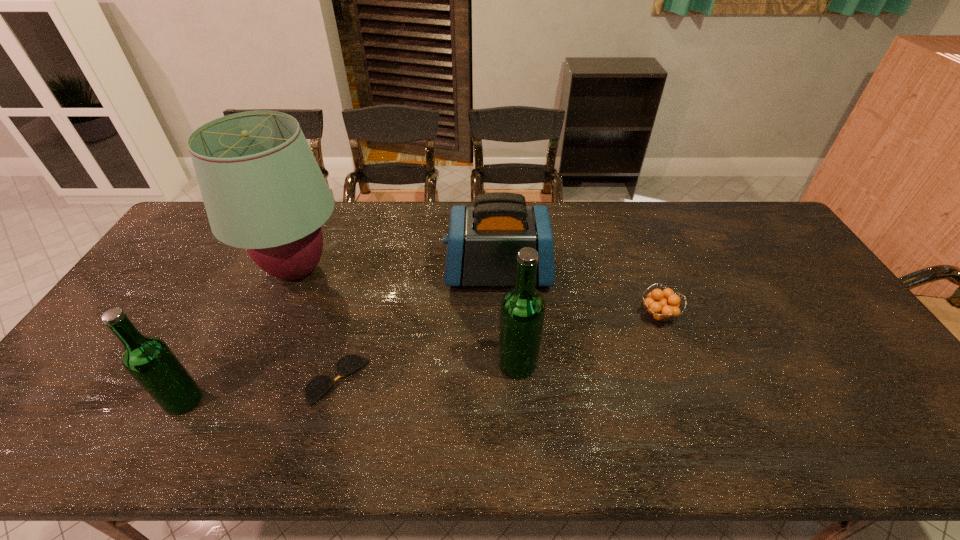
Locate an element on the screen. The height and width of the screenshot is (540, 960). vacant space located on the right of the right beer bottle is located at coordinates (568, 363).

At what (x,y) coordinates should I click in order to perform the action: click on free space located 0.200m on the left of the tallest object. Please return your answer as a coordinate pair (x, y). The image size is (960, 540). Looking at the image, I should click on (181, 270).

Where is `vacant space located on the front of the orange fruit`? The width and height of the screenshot is (960, 540). vacant space located on the front of the orange fruit is located at coordinates (676, 361).

The height and width of the screenshot is (540, 960). What are the coordinates of `free space located on the front-facing side of the toaster` in the screenshot? It's located at (420, 272).

You are a GUI agent. You are given a task and a screenshot of the screen. Output one action in this format:
    pyautogui.click(x=<x>, y=<y>)
    Task: Click on the vacant space located 0.260m on the front-facing side of the toaster
    Image resolution: width=960 pixels, height=540 pixels.
    Given the screenshot: What is the action you would take?
    pyautogui.click(x=363, y=272)

This screenshot has height=540, width=960. I want to click on vacant space located 0.400m on the front-facing side of the toaster, so click(319, 272).

Identify the location of vacant space located on the left of the spectacles. (204, 380).

This screenshot has height=540, width=960. What are the coordinates of `object at the far edge` in the screenshot? It's located at (263, 190).

Where is `beer bottle that is at the near edge`? This screenshot has width=960, height=540. beer bottle that is at the near edge is located at coordinates (x=149, y=360).

Where is `spectacles situated at the near edge`? The height and width of the screenshot is (540, 960). spectacles situated at the near edge is located at coordinates (318, 386).